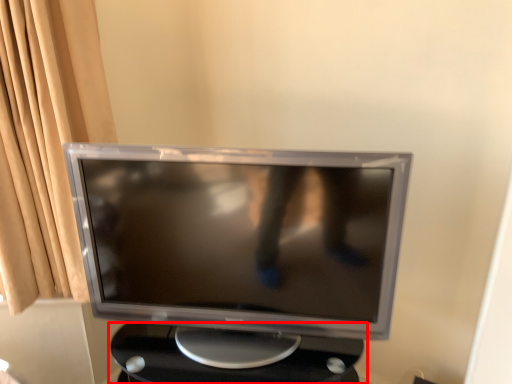
Question: From the image, what is the correct spatial relationship of table (annotated by the red box) in relation to computer monitor?

Choices:
 (A) right
 (B) left

Answer: (A)